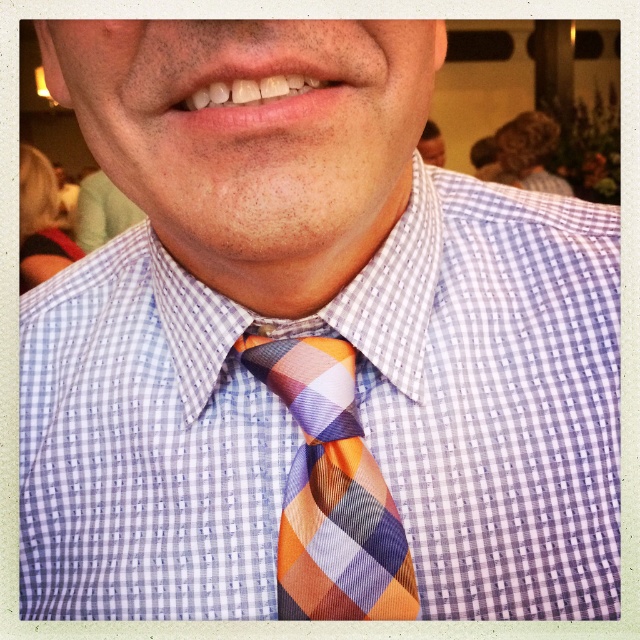
Question: Which object appears closest to the camera in this image?

Choices:
 (A) checkered fabric shirt at center
 (B) plaid silk tie at center

Answer: (B)

Question: Does checkered fabric shirt at center appear over plaid silk tie at center?

Choices:
 (A) no
 (B) yes

Answer: (B)

Question: Can you confirm if checkered fabric shirt at center is thinner than plaid silk tie at center?

Choices:
 (A) yes
 (B) no

Answer: (B)

Question: Does checkered fabric shirt at center appear on the right side of plaid silk tie at center?

Choices:
 (A) no
 (B) yes

Answer: (A)